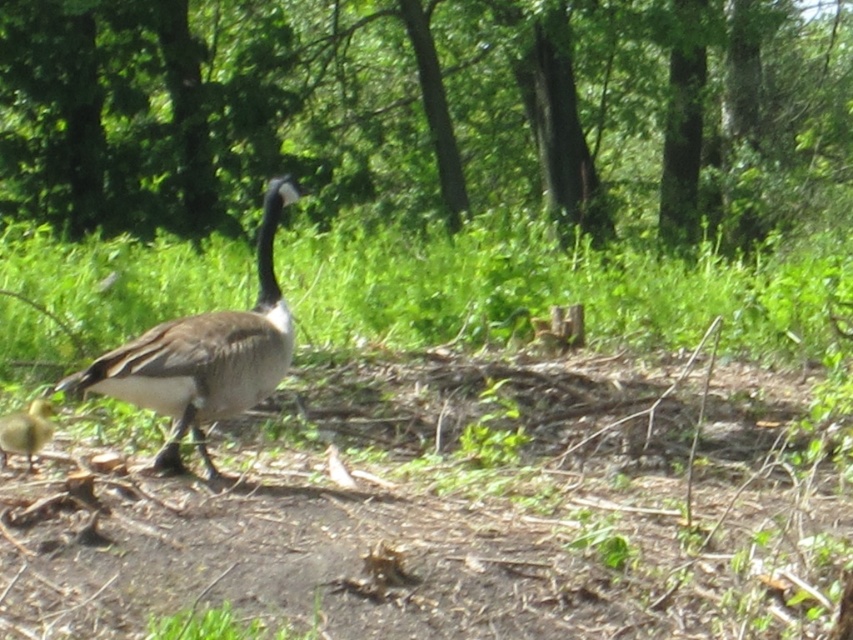
You are observing a Canada goose and its gosling in a grassy area. You notice a green leafy tree at upper center and a brown feathered goose at center. Which object is positioned higher in the image?

The green leafy tree at upper center is positioned higher in the image than the brown feathered goose at center.

You are standing at the origin point in this outdoor scene. There are two points marked in the image. Which of the two points, point (433, 256) or point (10, 429), is farther away from you?

Point (433, 256) is behind point (10, 429), so point (433, 256) is farther away from you.